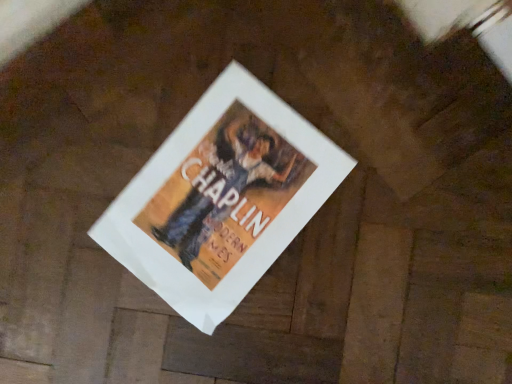
Image resolution: width=512 pixels, height=384 pixels. In order to click on vacant space situated above white paper at center (from a real-world perspective) in this screenshot , I will do `click(211, 195)`.